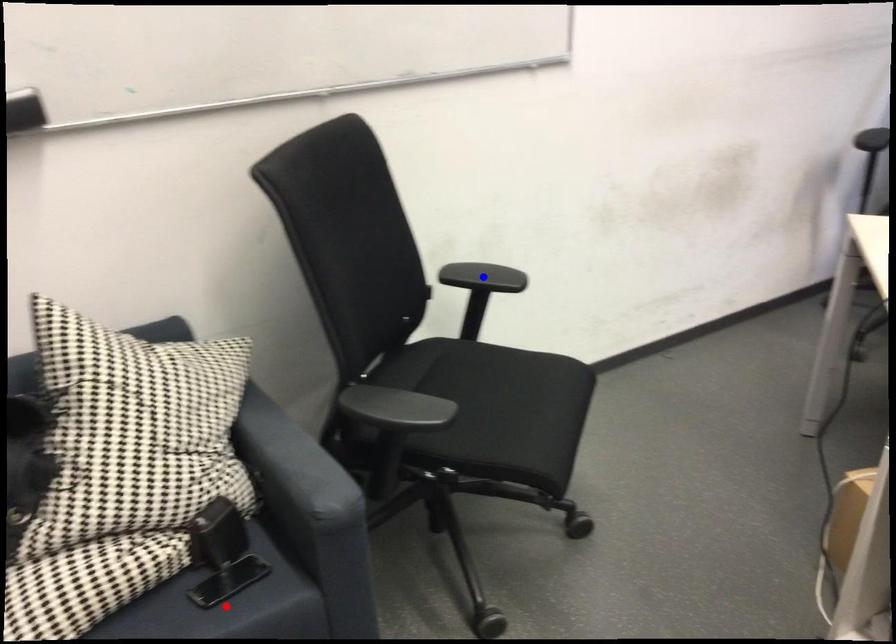
Question: Two points are marked on the image. Which point is closer to the camera?

Choices:
 (A) Blue point is closer.
 (B) Red point is closer.

Answer: (B)